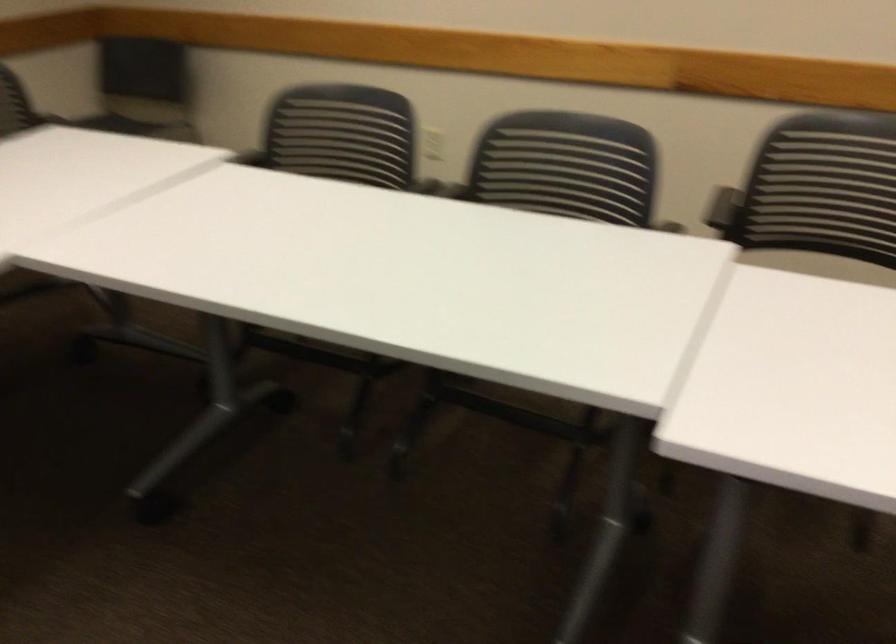
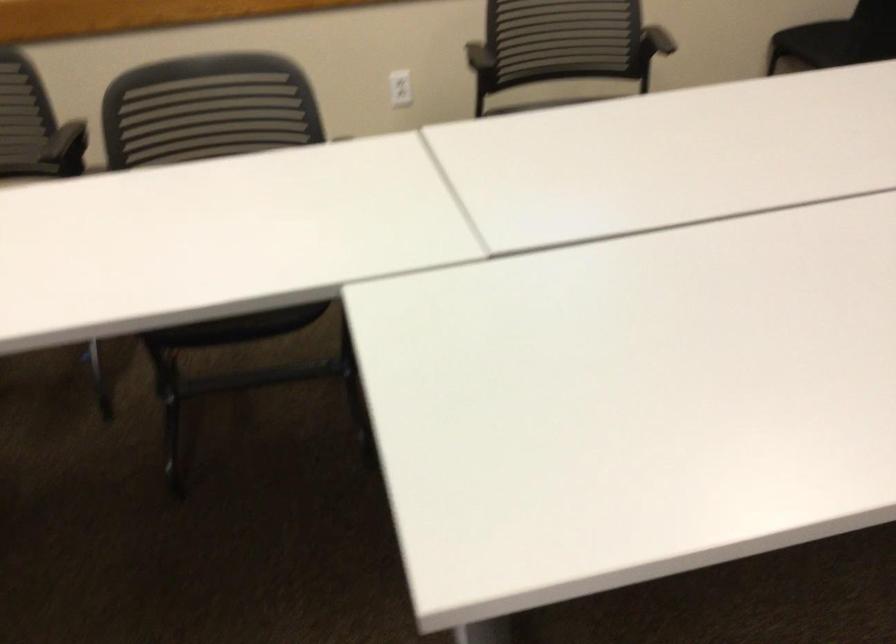
Question: The camera is either moving clockwise (left) or counter-clockwise (right) around the object. The first image is from the beginning of the video and the second image is from the end. Is the camera moving left or right when shooting the video?

Choices:
 (A) Left
 (B) Right

Answer: (A)